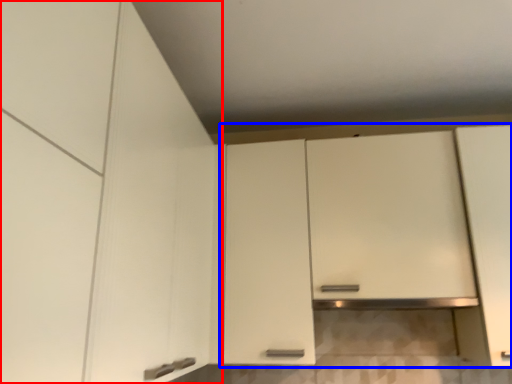
Question: Which point is closer to the camera, cabinetry (highlighted by a red box) or cabinetry (highlighted by a blue box)?

Choices:
 (A) cabinetry
 (B) cabinetry

Answer: (A)